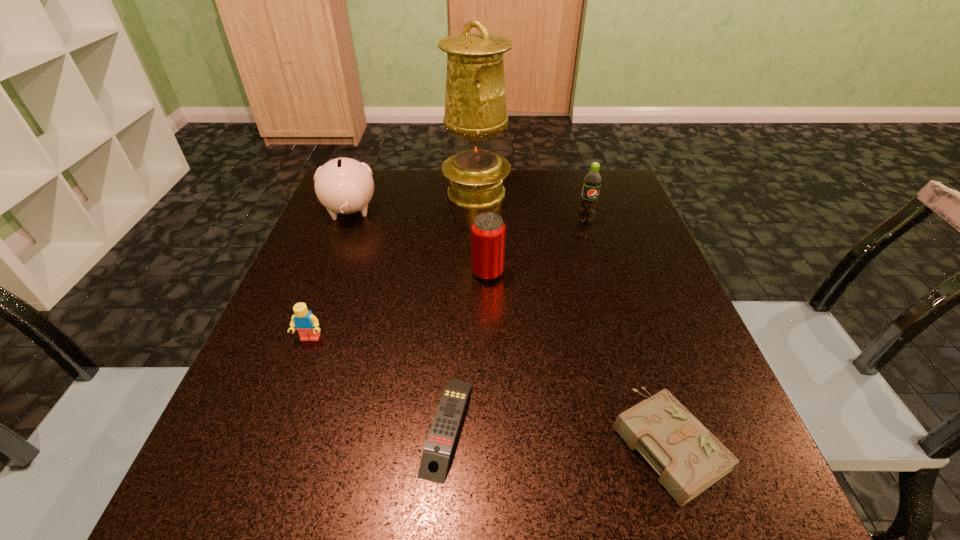
Locate an element on the screen. This screenshot has height=540, width=960. the tallest object is located at coordinates (475, 101).

This screenshot has width=960, height=540. Find the location of `soda`. soda is located at coordinates pos(592,181).

Locate an element on the screen. piggy bank is located at coordinates (343, 185).

The height and width of the screenshot is (540, 960). Identify the location of can. (488, 231).

Identify the location of Lego. (306, 324).

At what (x,y) coordinates should I click in order to perform the action: click on the third nearest object. Please return your answer as a coordinate pair (x, y). Looking at the image, I should click on (306, 324).

The image size is (960, 540). Identify the location of diary. (689, 459).

I want to click on remote control, so click(439, 445).

Identify the location of free location located on the right of the tallest object. The image size is (960, 540). [x=621, y=193].

Where is `free space located on the front label of the soda`? free space located on the front label of the soda is located at coordinates (607, 290).